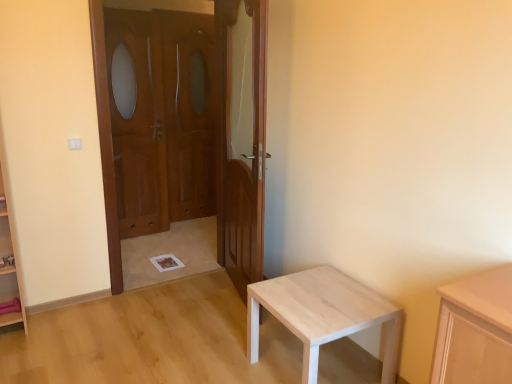
What are the coordinates of `vacant area situated to the left side of light wood table at lower right` in the screenshot? It's located at (221, 354).